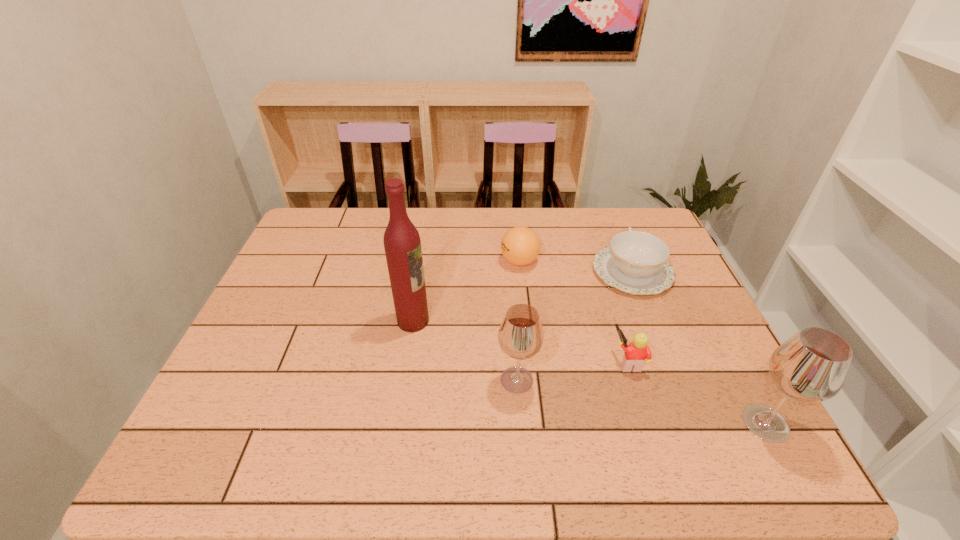
Identify the location of free space located in front of the Lego with the accessory visible. This screenshot has height=540, width=960. (558, 361).

Where is `chinaware at the far edge`? Image resolution: width=960 pixels, height=540 pixels. chinaware at the far edge is located at coordinates (635, 262).

Find the location of a particular element. This screenshot has height=540, width=960. ping-pong ball located at the far edge is located at coordinates (520, 245).

Find the location of a particular element. wineglass that is positioned at the right edge is located at coordinates 811,366.

Where is `chinaware present at the right edge`? The width and height of the screenshot is (960, 540). chinaware present at the right edge is located at coordinates (635, 262).

Identify the location of object that is at the far right corner. (635, 262).

This screenshot has width=960, height=540. Find the location of `object located in the near right corner section of the desktop`. object located in the near right corner section of the desktop is located at coordinates (811, 366).

In the image, there is a desktop. At what (x,y) coordinates should I click in order to perform the action: click on vacant space at the far edge. Please return your answer as a coordinate pair (x, y). Image resolution: width=960 pixels, height=540 pixels. Looking at the image, I should click on (370, 241).

Identify the location of vacant space at the near edge of the desktop. (316, 409).

The height and width of the screenshot is (540, 960). In the image, there is a desktop. Find the location of `vacant space at the left edge`. vacant space at the left edge is located at coordinates (320, 265).